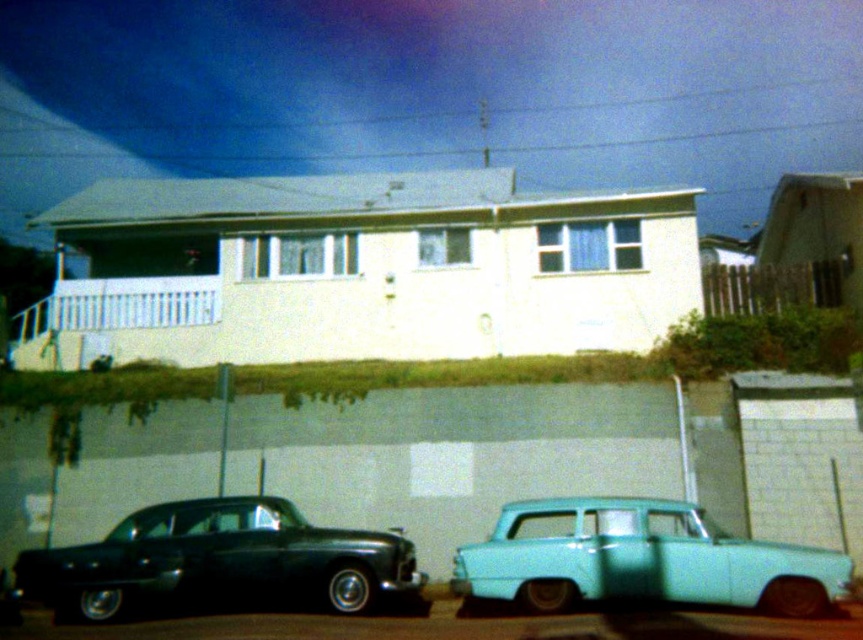
Looking at this image, does shiny black sedan at lower left have a greater width compared to light blue matte car at lower right?

Correct, the width of shiny black sedan at lower left exceeds that of light blue matte car at lower right.

Is shiny black sedan at lower left taller than light blue matte car at lower right?

Yes, shiny black sedan at lower left is taller than light blue matte car at lower right.

Between point (331, 540) and point (513, 541), which one is positioned behind?

The point (331, 540) is behind.

At what (x,y) coordinates should I click in order to perform the action: click on shiny black sedan at lower left. Please return your answer as a coordinate pair (x, y). The image size is (863, 640). Looking at the image, I should click on (222, 563).